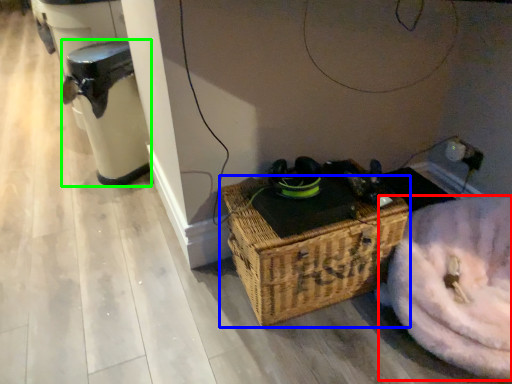
Question: Based on their relative distances, which object is nearer to washer (highlighted by a red box)? Choose from picnic basket (highlighted by a blue box) and water heater (highlighted by a green box).

Choices:
 (A) picnic basket
 (B) water heater

Answer: (A)